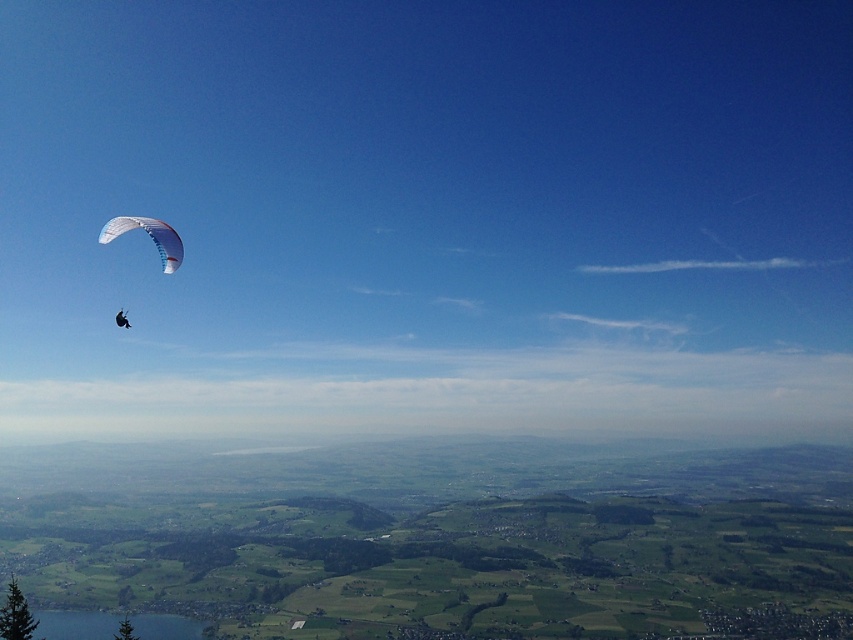
You are a pilot observing the sky and need to identify the parachutes. Which one is bigger between the white mesh parachute at left and the white fabric parachute at upper left?

The white mesh parachute at left is larger in size compared to the white fabric parachute at upper left according to the description.

You are a pilot observing the sky and see the white mesh parachute at left and the white fabric parachute at upper left. Which parachute has a larger width according to the description?

The white mesh parachute at left might be wider than white fabric parachute at upper left.